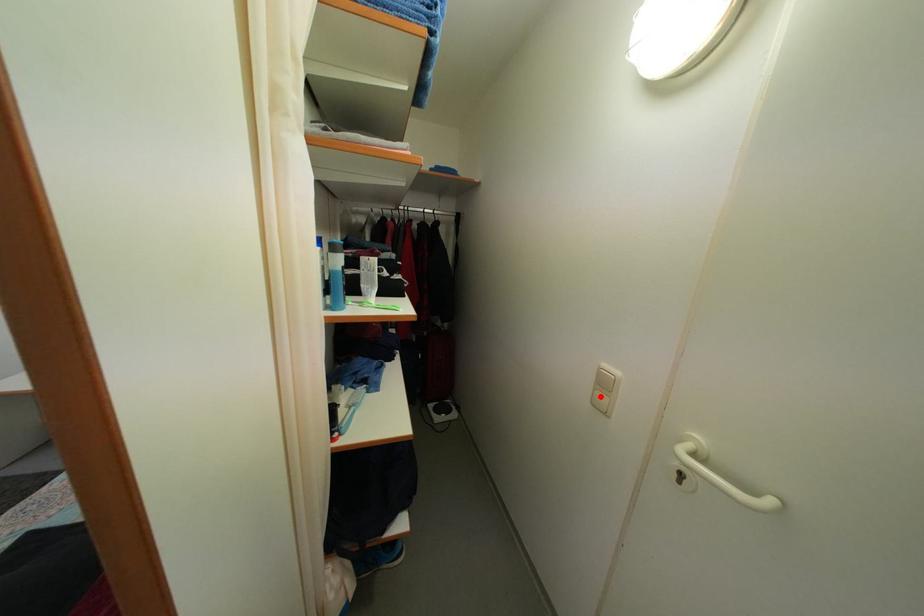
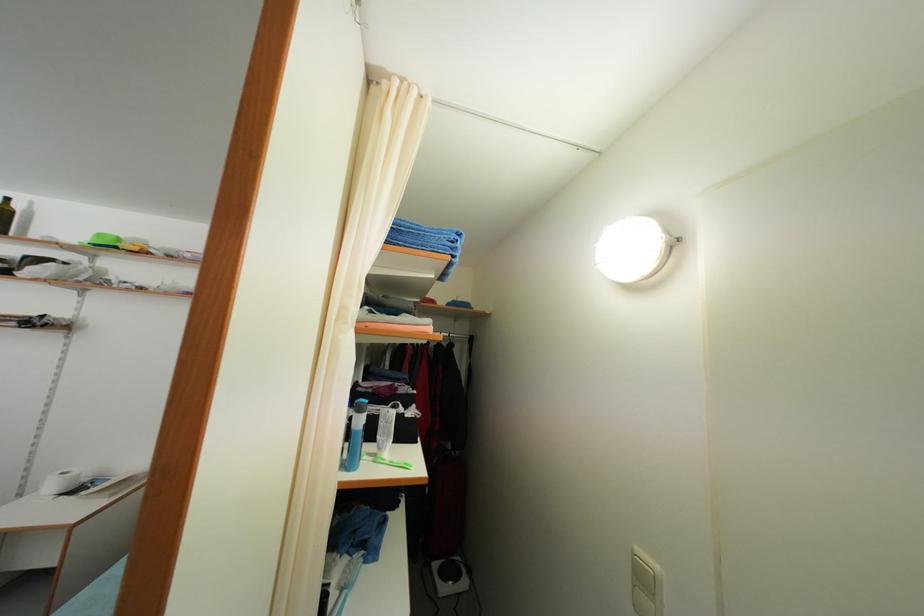
Find the pixel in the second image that matches the highlighted location in the first image.

(639, 593)